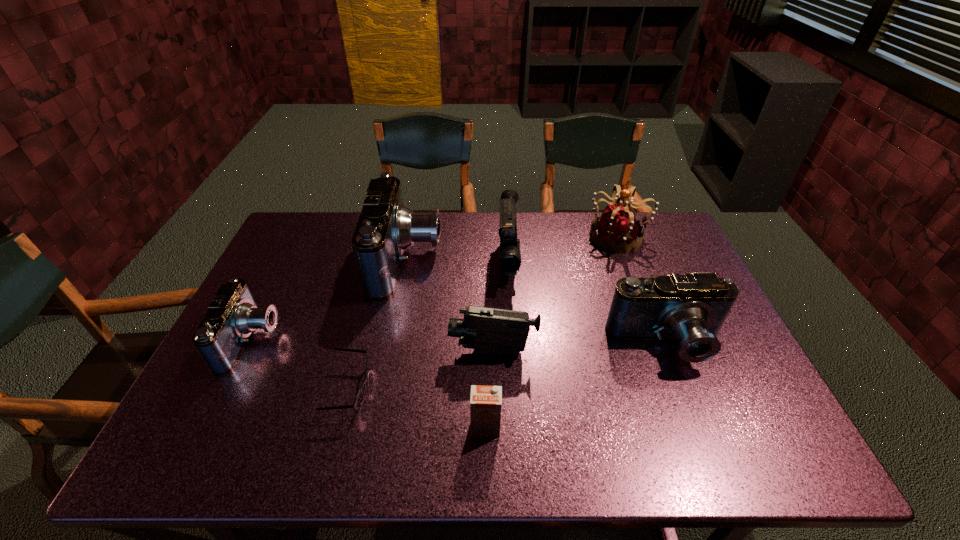
Locate an element on the screen. vacant space located on the front-facing side of the smaller black camcorder is located at coordinates (328, 351).

At what (x,y) coordinates should I click in order to perform the action: click on vacant position located on the front-facing side of the leftmost object. Please return your answer as a coordinate pair (x, y). Looking at the image, I should click on (406, 340).

You are a GUI agent. You are given a task and a screenshot of the screen. Output one action in this format:
    pyautogui.click(x=<x>, y=<y>)
    Task: Click on the vacant region located on the right of the orange orange juice
    The width and height of the screenshot is (960, 540).
    Given the screenshot: What is the action you would take?
    pyautogui.click(x=577, y=427)

The height and width of the screenshot is (540, 960). I want to click on free location located 0.180m on the front-facing side of the spectacles, so click(x=444, y=389).

You are a GUI agent. You are given a task and a screenshot of the screen. Output one action in this format:
    pyautogui.click(x=<x>, y=<y>)
    Task: Click on the tiara that is at the far edge
    
    Given the screenshot: What is the action you would take?
    pyautogui.click(x=618, y=229)

Where is `object that is at the near edge`? The width and height of the screenshot is (960, 540). object that is at the near edge is located at coordinates (485, 401).

At what (x,y) coordinates should I click in order to perform the action: click on object situated at the left edge. Please return your answer as a coordinate pair (x, y). The image size is (960, 540). Looking at the image, I should click on (232, 316).

Locate an element on the screen. tiara that is positioned at the right edge is located at coordinates (618, 229).

Where is `camcorder located in the right edge section of the desktop`? camcorder located in the right edge section of the desktop is located at coordinates pyautogui.click(x=691, y=308).

Locate an element on the screen. Image resolution: width=960 pixels, height=540 pixels. object that is at the far right corner is located at coordinates (618, 229).